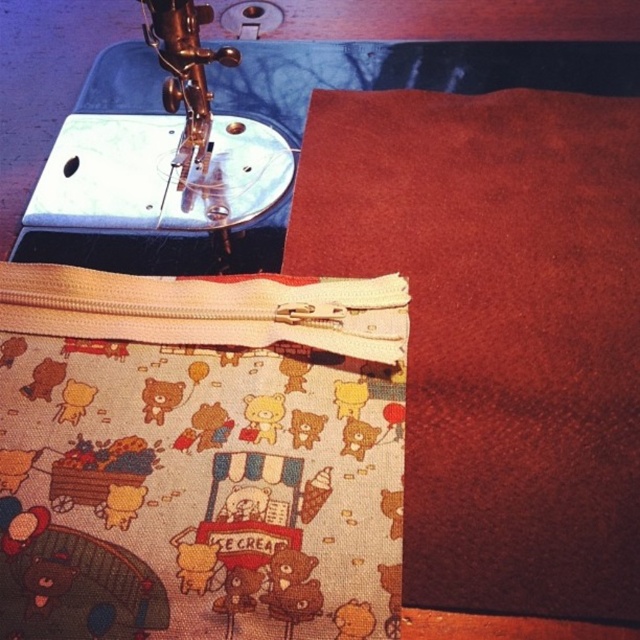
Question: Which point appears farthest from the camera in this image?

Choices:
 (A) (173, 13)
 (B) (257, 456)
 (C) (509, 387)

Answer: (A)

Question: Which of these objects is positioned farthest from the beige fabric pouch at center?

Choices:
 (A) matte brown fabric at center
 (B) metallic sewing machine at upper left

Answer: (B)

Question: Among these points, which one is farthest from the camera?

Choices:
 (A) (179, 26)
 (B) (0, 557)

Answer: (A)

Question: Can you confirm if beige fabric pouch at center is thinner than matte brown fabric at center?

Choices:
 (A) yes
 (B) no

Answer: (A)

Question: Is matte brown fabric at center wider than metallic sewing machine at upper left?

Choices:
 (A) yes
 (B) no

Answer: (A)

Question: Can you confirm if beige fabric pouch at center is positioned to the right of matte brown fabric at center?

Choices:
 (A) no
 (B) yes

Answer: (A)